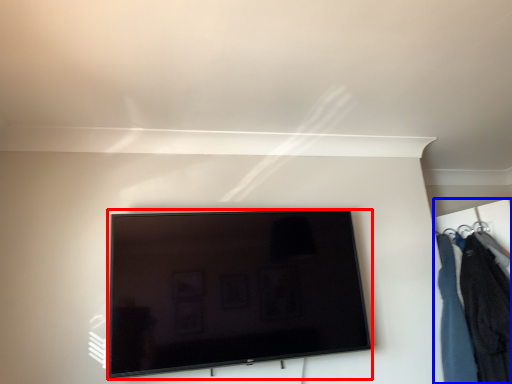
Question: Among these objects, which one is nearest to the camera, television (highlighted by a red box) or closet (highlighted by a blue box)?

Choices:
 (A) television
 (B) closet

Answer: (A)